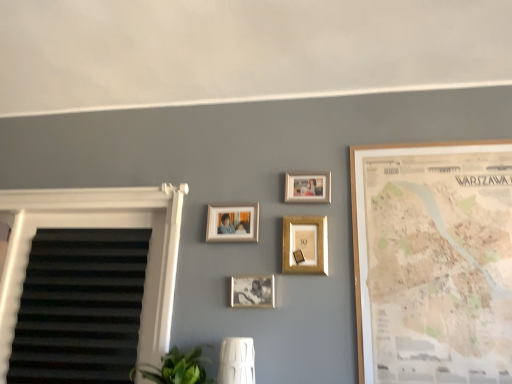
Question: In the image, is green leafy plant at lower center on the left side or the right side of wooden map at right, positioned as the 1th picture frame in right-to-left order?

Choices:
 (A) right
 (B) left

Answer: (B)

Question: Does point (205, 382) appear closer or farther from the camera than point (391, 215)?

Choices:
 (A) farther
 (B) closer

Answer: (B)

Question: Based on their relative distances, which object is farther from the metallic silver photo frame at center, which is the 2th picture frame in left-to-right order?

Choices:
 (A) gold metallic picture frame at center, positioned as the 3th picture frame in left-to-right order
 (B) white textured blind at left
 (C) green leafy plant at lower center
 (D) wooden map at right, acting as the 5th picture frame starting from the left
 (E) matte silver photo frame at center, which ranks as the first picture frame in left-to-right order

Answer: (B)

Question: Estimate the real-world distances between objects in this image. Which object is closer to the metallic silver photo frame at center, arranged as the fourth picture frame when viewed from the right?

Choices:
 (A) wooden map at right, acting as the 5th picture frame starting from the left
 (B) green leafy plant at lower center
 (C) gold metallic picture frame at center, positioned as the 3th picture frame in left-to-right order
 (D) matte gold picture frame at upper center, which is the second picture frame from right to left
 (E) white textured blind at left

Answer: (C)